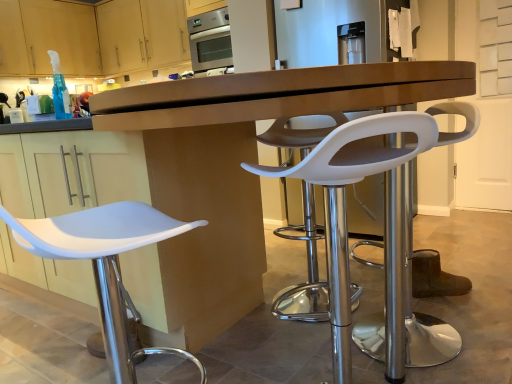
Where is `vacant space that is to the left of white plastic stool at center, which is counted as the 3th chair, starting from the left`? The height and width of the screenshot is (384, 512). vacant space that is to the left of white plastic stool at center, which is counted as the 3th chair, starting from the left is located at coordinates (327, 355).